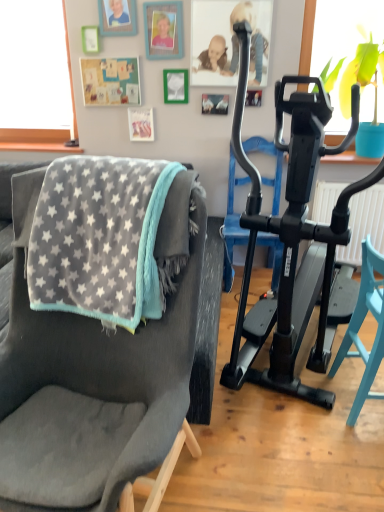
Question: From a real-world perspective, is black rubber exercise machine at right physically above soft gray fabric chair at left, placed as the second chair when sorted from right to left?

Choices:
 (A) yes
 (B) no

Answer: (B)

Question: Is black rubber exercise machine at right not within soft gray fabric chair at left, placed as the second chair when sorted from right to left?

Choices:
 (A) no
 (B) yes

Answer: (B)

Question: Can you confirm if black rubber exercise machine at right is taller than soft gray fabric chair at left, placed as the second chair when sorted from right to left?

Choices:
 (A) no
 (B) yes

Answer: (A)

Question: Is soft gray fabric chair at left, the first chair when ordered from left to right, located within black rubber exercise machine at right?

Choices:
 (A) yes
 (B) no

Answer: (B)

Question: Considering the relative sizes of black rubber exercise machine at right and soft gray fabric chair at left, placed as the second chair when sorted from right to left, in the image provided, is black rubber exercise machine at right smaller than soft gray fabric chair at left, placed as the second chair when sorted from right to left,?

Choices:
 (A) no
 (B) yes

Answer: (B)

Question: From a real-world perspective, is gray fleece blanket at left positioned above or below black plastic stationary bicycle at right?

Choices:
 (A) above
 (B) below

Answer: (A)

Question: In the image, is gray fleece blanket at left positioned in front of or behind black plastic stationary bicycle at right?

Choices:
 (A) front
 (B) behind

Answer: (B)

Question: Is gray fleece blanket at left inside the boundaries of black plastic stationary bicycle at right, or outside?

Choices:
 (A) outside
 (B) inside

Answer: (A)

Question: Would you say gray fleece blanket at left is to the left or to the right of black plastic stationary bicycle at right in the picture?

Choices:
 (A) right
 (B) left

Answer: (B)

Question: From their relative heights in the image, would you say black plastic stationary bicycle at right is taller or shorter than smooth skin baby at upper center?

Choices:
 (A) tall
 (B) short

Answer: (A)

Question: Looking at their shapes, would you say black plastic stationary bicycle at right is wider or thinner than smooth skin baby at upper center?

Choices:
 (A) thin
 (B) wide

Answer: (B)

Question: From a real-world perspective, is black plastic stationary bicycle at right above or below smooth skin baby at upper center?

Choices:
 (A) above
 (B) below

Answer: (B)

Question: Is black plastic stationary bicycle at right situated inside smooth skin baby at upper center or outside?

Choices:
 (A) outside
 (B) inside

Answer: (A)

Question: From their relative heights in the image, would you say translucent glass window screen at upper right is taller or shorter than black rubber exercise machine at right?

Choices:
 (A) tall
 (B) short

Answer: (B)

Question: Relative to black rubber exercise machine at right, is translucent glass window screen at upper right in front or behind?

Choices:
 (A) behind
 (B) front

Answer: (B)